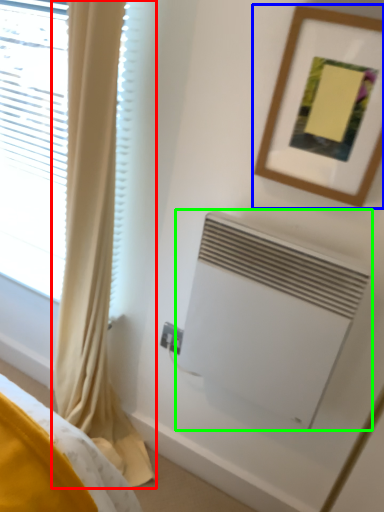
Question: Based on their relative distances, which object is farther from curtain (highlighted by a red box)? Choose from picture frame (highlighted by a blue box) and air conditioning (highlighted by a green box).

Choices:
 (A) picture frame
 (B) air conditioning

Answer: (A)